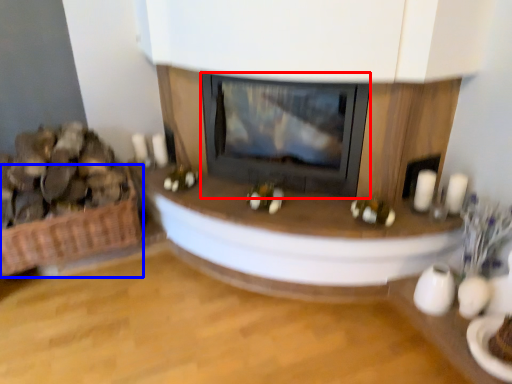
Question: Which point is closer to the camera, wood burning stove (highlighted by a red box) or basket (highlighted by a blue box)?

Choices:
 (A) wood burning stove
 (B) basket

Answer: (A)